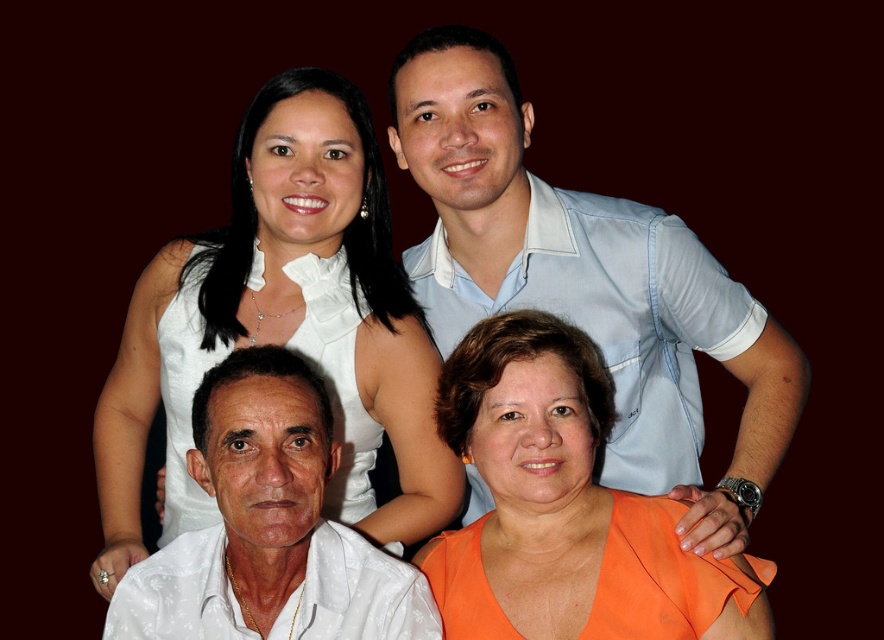
Looking at the two people in the upper center of the group photo, which one is wearing the white satin dress at upper center and positioned to the left of the person in the light blue shirt at upper center?

The white satin dress at upper center is to the left of the light blue shirt at upper center.

You are a photographer standing 6 feet away from the camera. You want to take a photo of the woman in the white satin dress at upper center. Can you reach her within your current distance without moving closer?

The white satin dress at upper center and camera are 5.34 feet apart. Since you are 6 feet away from the camera, you are slightly farther than the required distance. To capture the woman in the white satin dress at upper center clearly, you might need to move 0.66 feet closer to be within the 5.34 feet range.

You are standing in front of the image and want to determine the location of the white satin dress at upper center. Based on the coordinates provided, can you describe its position relative to the other people in the group?

The white satin dress at upper center is positioned at coordinates point (282, 324), which places it centrally in the image. This means it is located above and slightly to the right of the man in the foreground and directly in front of the woman standing behind him, as well as aligned with the central area between the two men and women in the group.